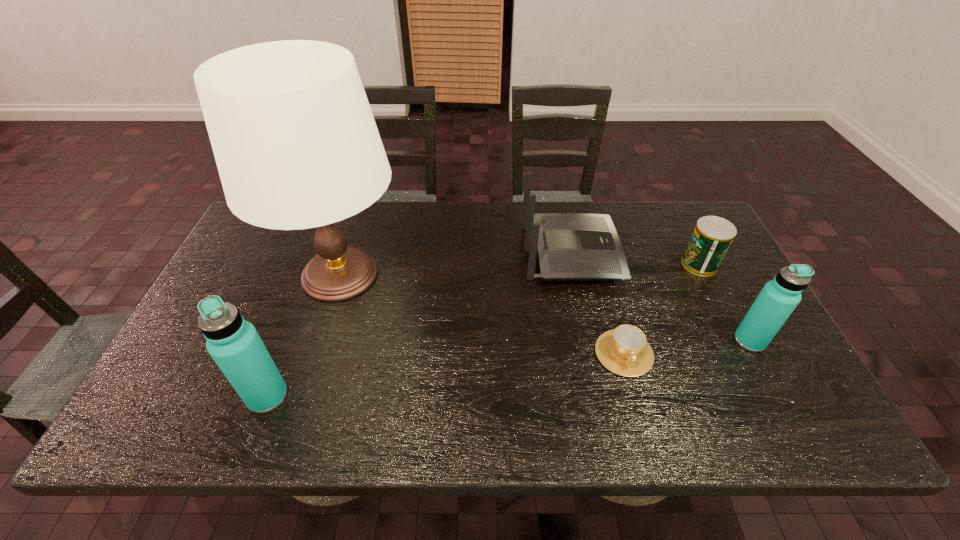
Locate an element on the screen. This screenshot has height=540, width=960. object at the far left corner is located at coordinates (296, 145).

You are a GUI agent. You are given a task and a screenshot of the screen. Output one action in this format:
    pyautogui.click(x=<x>, y=<y>)
    Task: Click on the free space at the far edge of the desktop
    The height and width of the screenshot is (540, 960).
    Given the screenshot: What is the action you would take?
    pyautogui.click(x=426, y=216)

You are a GUI agent. You are given a task and a screenshot of the screen. Output one action in this format:
    pyautogui.click(x=<x>, y=<y>)
    Task: Click on the vacant space at the near edge
    
    Given the screenshot: What is the action you would take?
    pyautogui.click(x=490, y=392)

In the image, there is a desktop. Where is `blank space at the left edge`? Image resolution: width=960 pixels, height=540 pixels. blank space at the left edge is located at coordinates (260, 298).

Locate an element on the screen. free space at the right edge is located at coordinates (747, 350).

Identify the location of free space at the near right corner of the desktop. (777, 369).

This screenshot has height=540, width=960. I want to click on empty location between the fourth tallest object and the lamp, so click(x=456, y=264).

The image size is (960, 540). In order to click on vacant area that lies between the shorter water bottle and the tallest object in this screenshot , I will do `click(545, 308)`.

You are a GUI agent. You are given a task and a screenshot of the screen. Output one action in this format:
    pyautogui.click(x=<x>, y=<y>)
    Task: Click on the free spot between the nearer water bottle and the can
    Image resolution: width=960 pixels, height=540 pixels.
    Given the screenshot: What is the action you would take?
    pyautogui.click(x=484, y=330)

This screenshot has height=540, width=960. Find the location of `free space between the shorter water bottle and the nearest object`. free space between the shorter water bottle and the nearest object is located at coordinates (509, 368).